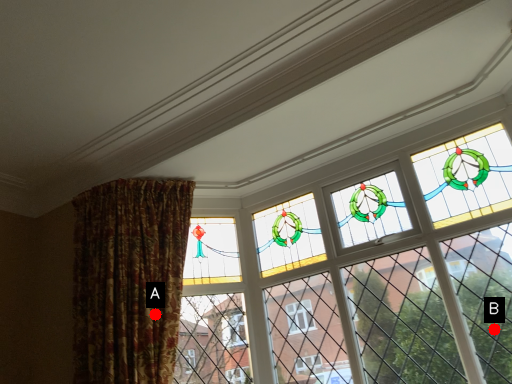
Question: Two points are circled on the image, labeled by A and B beside each circle. Among these points, which one is farthest from the camera?

Choices:
 (A) A is further
 (B) B is further

Answer: (A)